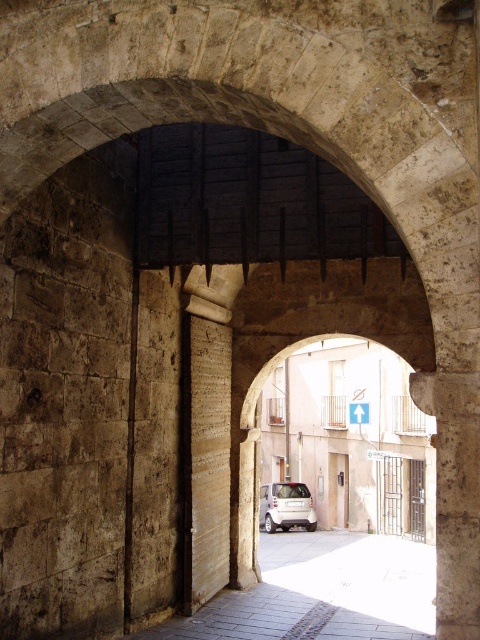
You are driving a white matte car at center and want to exit the narrow street through the archway. Can you safely back out without hitting the smooth stone alley at center?

The smooth stone alley at center is in front of the white matte car at center, so backing out would require moving forward first to clear the alleyway. Therefore, you cannot safely back out without hitting the smooth stone alley at center.